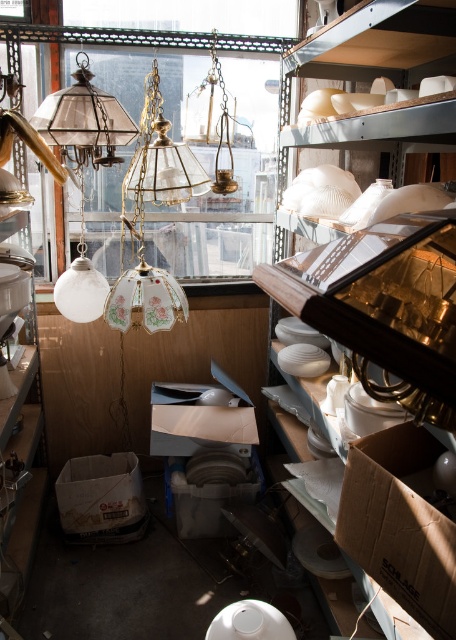
You are a delivery person who just arrived at the storage area. You need to place a new package at the location marked by point (400,524). Where should you place it?

The point (400,524) corresponds to the brown cardboard box at lower right, so you should place the new package near the brown cardboard box at lower right.

Looking at this image, you are organizing items in the storage area and need to place a new item that requires a larger space. Which box should you choose to place it on top of, the brown cardboard box at lower right or the white cardboard box at center?

The white cardboard box at center is larger in size compared to the brown cardboard box at lower right, so you should place the new item on top of the white cardboard box at center to accommodate its larger space requirement.

You are standing in the storage area and want to reach a specific point. The point you need to reach is at point [368,445]. Considering your height is 5.5 feet, will you be able to comfortably reach that point without needing a stool?

The distance between you and point [368,445] is 3.86 feet. Since the point is 3.86 feet away from you, and your height is 5.5 feet, you should be able to comfortably reach it without needing a stool.